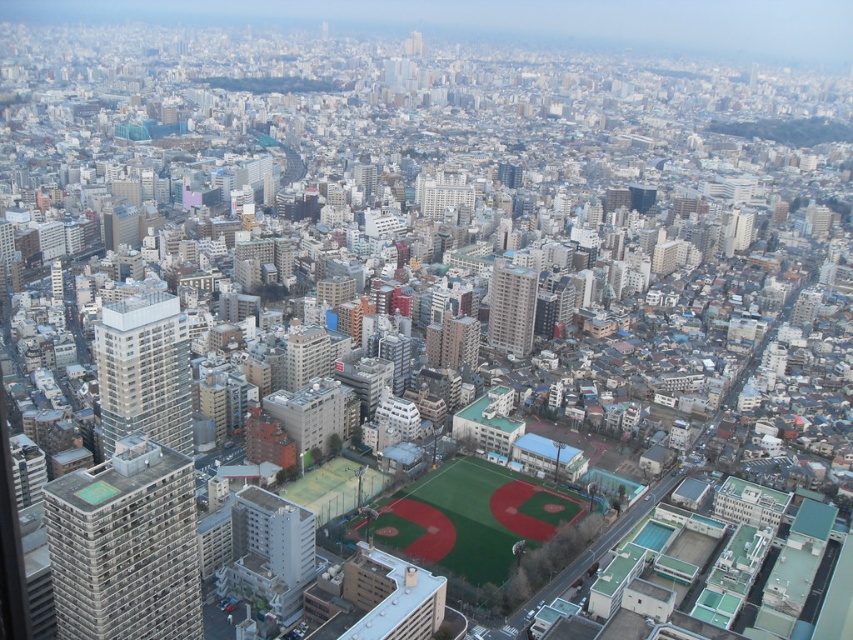
You are a drone operator flying a drone that has a maximum flight range of 150 meters. You are currently hovering above the green artificial turf baseball field at center. Can you safely return to your starting position without exceeding the drone battery range?

The green artificial turf baseball field at center is 166.34 meters away from camera, so the drone is already beyond its maximum flight range of 150 meters. It cannot safely return to the starting position without exceeding the battery range.

You are a drone operator flying a drone with a maximum flight range of 200 meters. You are currently at the camera position and want to fly to point (567, 509). Will your drone be able to reach that point without exceeding its range?

The distance between point (567, 509) and the camera is 192.96 meters, which is within the drone operator drone maximum flight range of 200 meters. Therefore, the drone can reach the point without exceeding its range.

You are a drone operator flying over the city and need to deliver a package to the gray concrete building at lower left. However, you must avoid flying over the green artificial turf baseball field at center. Can you safely navigate around the baseball field to reach the building?

The gray concrete building at lower left is in front of the green artificial turf baseball field at center, so the drone can fly directly to the building without crossing over the baseball field.